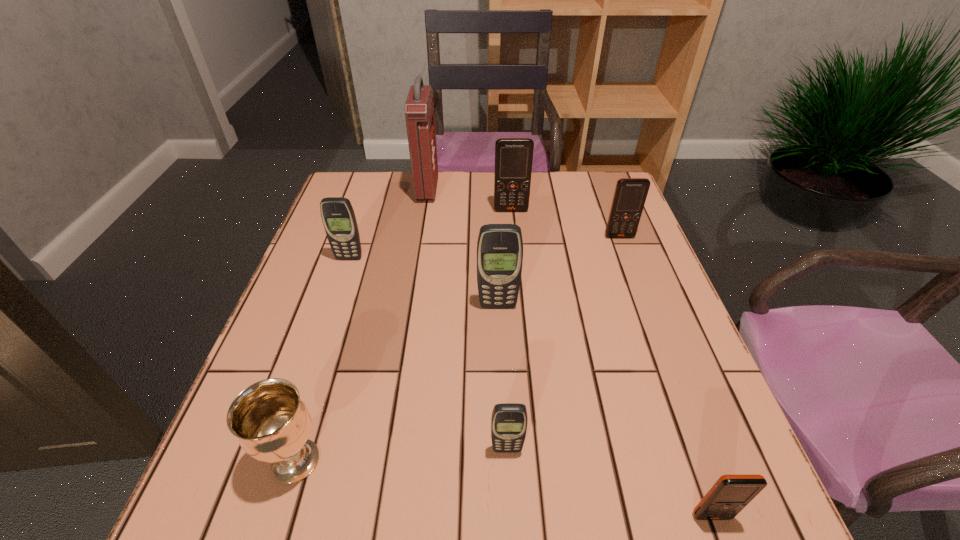
I want to click on vacant space in between the smallest gray cellular telephone and the third farthest cellular telephone, so click(x=428, y=354).

I want to click on empty space that is in between the tallest object and the biggest orange cellular telephone, so click(x=469, y=200).

The height and width of the screenshot is (540, 960). I want to click on vacant area between the farthest cellular telephone and the chalice, so click(x=403, y=335).

Identify the location of free space between the chalice and the second farthest gray cellular telephone. The image size is (960, 540). (396, 383).

Locate an element on the screen. object that is the fifth nearest to the fourth nearest cellular telephone is located at coordinates (509, 421).

Select which object is the closest to the fifth farthest object. Please provide its 2D coordinates. Your answer should be formatted as a tuple, i.e. [(x, y)], where the tuple contains the x and y coordinates of a point satisfying the conditions above.

[(509, 421)]

Locate which cellular telephone ranks in proximity to the leftmost gray cellular telephone. Please provide its 2D coordinates. Your answer should be formatted as a tuple, i.e. [(x, y)], where the tuple contains the x and y coordinates of a point satisfying the conditions above.

[(500, 246)]

Locate which cellular telephone is the closest to the leftmost cellular telephone. Please provide its 2D coordinates. Your answer should be formatted as a tuple, i.e. [(x, y)], where the tuple contains the x and y coordinates of a point satisfying the conditions above.

[(500, 246)]

Identify which orange cellular telephone is the third closest to the red first-aid kit. Please provide its 2D coordinates. Your answer should be formatted as a tuple, i.e. [(x, y)], where the tuple contains the x and y coordinates of a point satisfying the conditions above.

[(730, 494)]

Find the location of a particular element. Image resolution: width=960 pixels, height=540 pixels. the closest orange cellular telephone to the biggest gray cellular telephone is located at coordinates (630, 194).